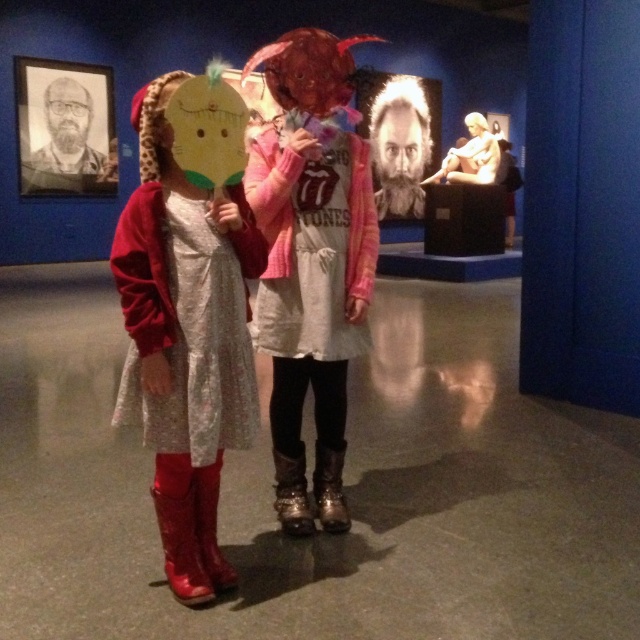
Is shiny red boots at left taller than shiny red boot at lower left?

Yes.

Is point (298, 61) positioned behind point (214, 572)?

That is True.

I want to click on shiny red boots at left, so pyautogui.click(x=184, y=323).

Is the position of shiny red boots at left less distant than that of shiny metallic boot at lower left?

Yes, shiny red boots at left is closer to the viewer.

Does shiny red boots at left have a lesser width compared to shiny metallic boot at lower left?

No.

Find the location of `shiny red boots at left`. shiny red boots at left is located at coordinates (184, 323).

Is white floral fabric dress at center in front of shiny metallic boot at lower left?

Yes, it is.

Looking at this image, who is more forward, (234, 305) or (192, 564)?

Positioned in front is point (234, 305).

Does point (196, 220) come farther from viewer compared to point (189, 488)?

No, it is in front of (189, 488).

The width and height of the screenshot is (640, 640). I want to click on white floral fabric dress at center, so click(x=188, y=323).